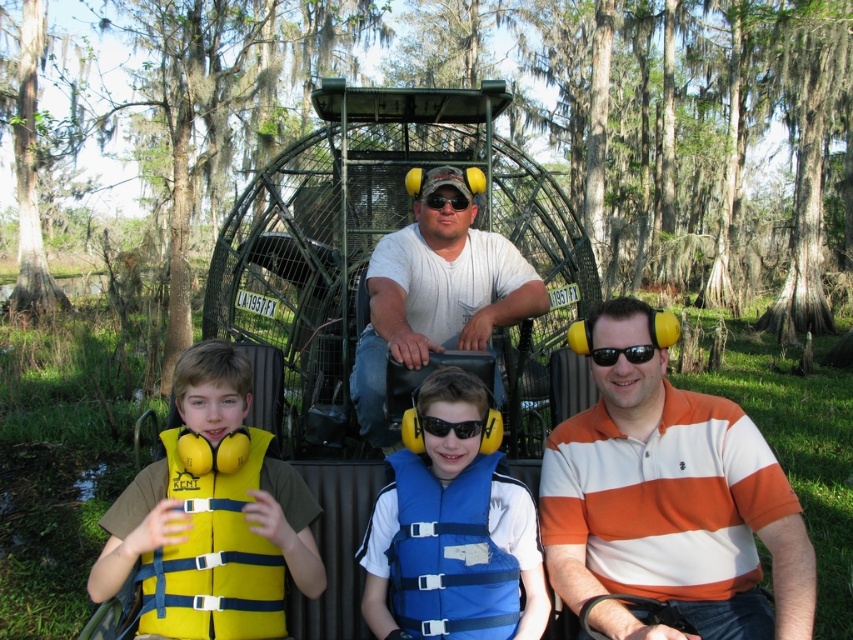
Identify the location of black plastic sunglasses at center. This screenshot has width=853, height=640. (622, 355).

Who is more forward, [642,355] or [456,205]?

Point [642,355]

Which is in front, point (634, 364) or point (454, 196)?

Positioned in front is point (634, 364).

Where is `black plastic sunglasses at center`? This screenshot has height=640, width=853. black plastic sunglasses at center is located at coordinates (622, 355).

Can you confirm if white matte shirt at center is bigger than black plastic sunglasses at center?

Indeed, white matte shirt at center has a larger size compared to black plastic sunglasses at center.

Does point (397, 250) come behind point (643, 352)?

That is True.

Where is `white matte shirt at center`? The image size is (853, 640). white matte shirt at center is located at coordinates (434, 294).

Which of these two, blue life vest at center or yellow fabric life jacket at left, stands taller?

blue life vest at center is taller.

This screenshot has height=640, width=853. I want to click on blue life vest at center, so click(451, 548).